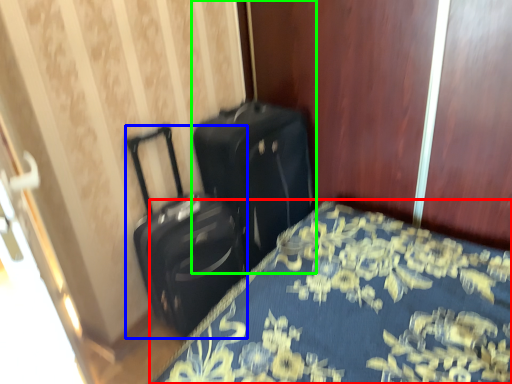
Question: Considering the real-world distances, which object is farthest from bed (highlighted by a red box)? suitcase (highlighted by a blue box) or suitcase (highlighted by a green box)?

Choices:
 (A) suitcase
 (B) suitcase

Answer: (A)